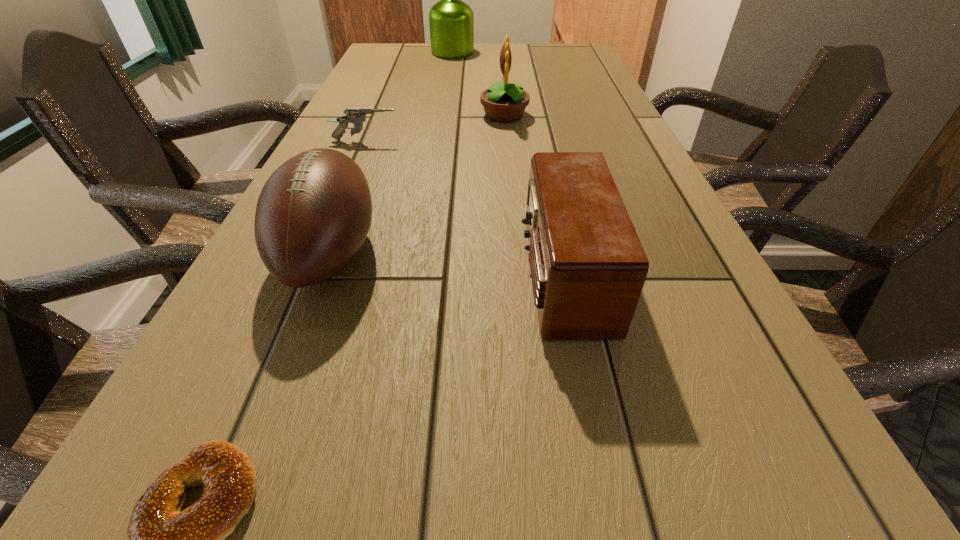
Image resolution: width=960 pixels, height=540 pixels. In order to click on the third object from right to left in this screenshot , I will do `click(451, 21)`.

Identify the location of the farthest object. (451, 21).

Locate an element on the screen. Image resolution: width=960 pixels, height=540 pixels. the fifth nearest object is located at coordinates (503, 102).

Where is `football (American)`? football (American) is located at coordinates (314, 212).

Find the location of a particular element. the fourth tallest object is located at coordinates (588, 267).

This screenshot has width=960, height=540. Identify the location of the fourth nearest object. (357, 116).

This screenshot has height=540, width=960. What are the coordinates of `gun` in the screenshot? It's located at (357, 116).

Where is `vacant space located 0.210m on the left of the fourth object from left to right`? This screenshot has width=960, height=540. vacant space located 0.210m on the left of the fourth object from left to right is located at coordinates (372, 52).

At what (x,y) coordinates should I click in order to perform the action: click on vacant space situated on the face of the fifth nearest object. Please return your answer as a coordinate pair (x, y). The height and width of the screenshot is (540, 960). Looking at the image, I should click on (454, 115).

You are a GUI agent. You are given a task and a screenshot of the screen. Output one action in this format:
    pyautogui.click(x=<x>, y=<y>)
    Task: Click on the free spot located 0.290m on the face of the fifth nearest object
    The width and height of the screenshot is (960, 540).
    Given the screenshot: What is the action you would take?
    pyautogui.click(x=371, y=115)